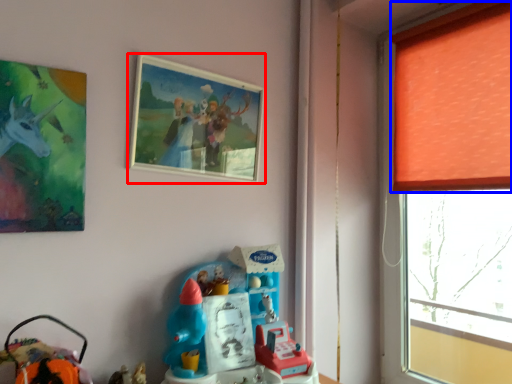
Question: Which of the following is the farthest to the observer, picture frame (highlighted by a red box) or curtain (highlighted by a blue box)?

Choices:
 (A) picture frame
 (B) curtain

Answer: (B)